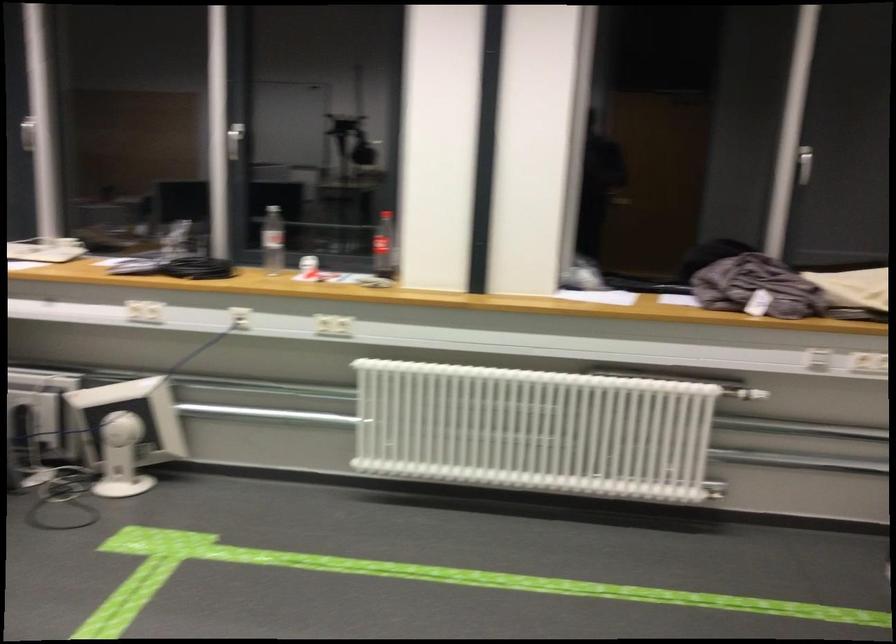
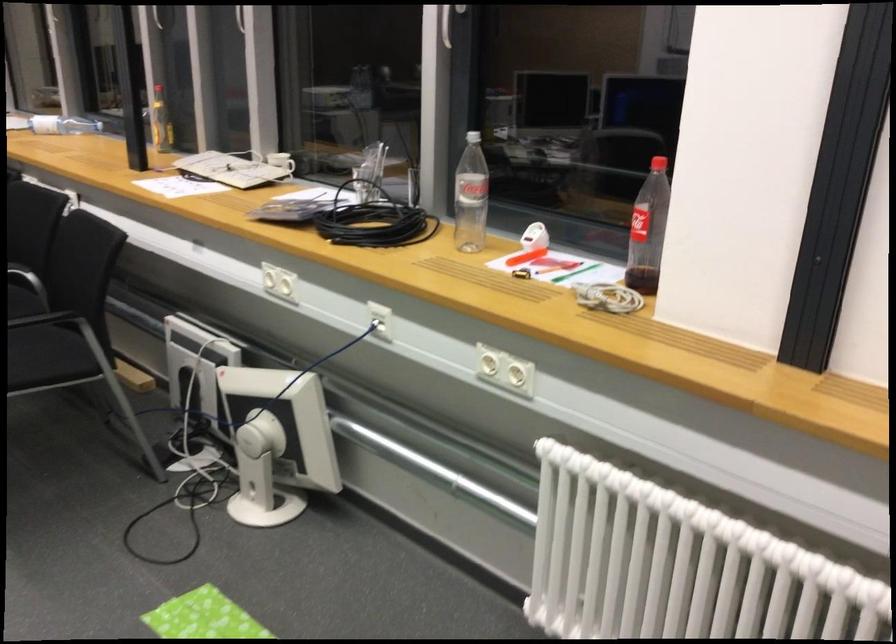
Locate, in the second image, the point that corresponds to (x=389, y=254) in the first image.

(648, 230)